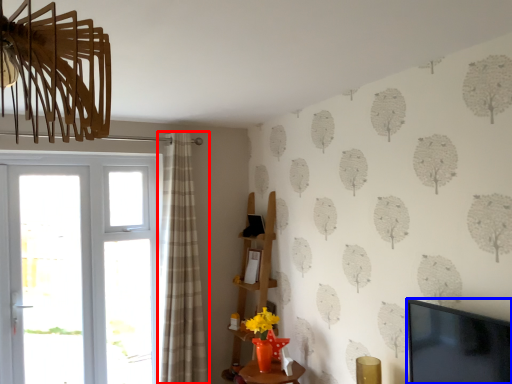
Question: Which object is closer to the camera taking this photo, curtain (highlighted by a red box) or television (highlighted by a blue box)?

Choices:
 (A) curtain
 (B) television

Answer: (B)